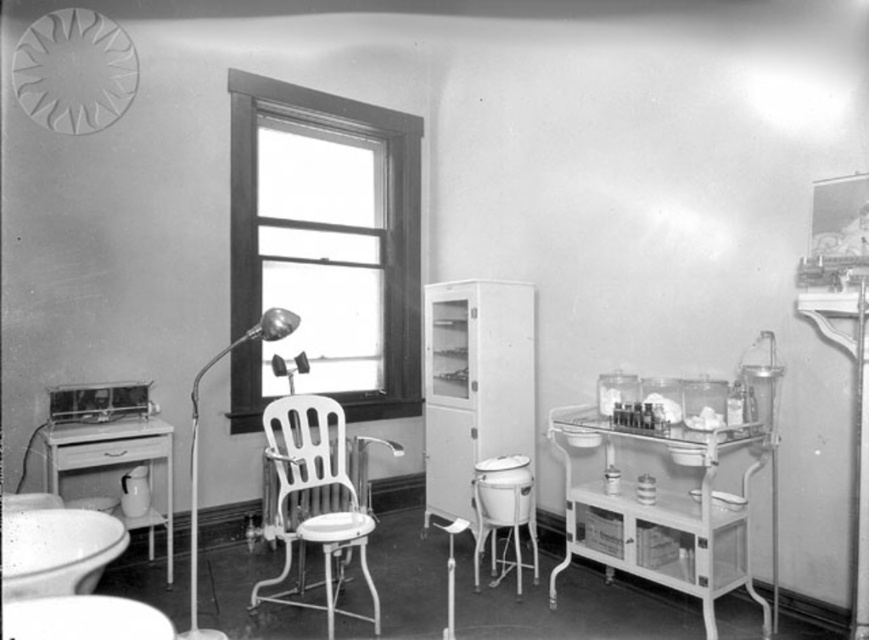
Question: In this image, where is white plastic chair at center located relative to white glossy table at left?

Choices:
 (A) below
 (B) above

Answer: (A)

Question: Can you confirm if wooden frame window at center is positioned above metallic/reflective lamp at center-left?

Choices:
 (A) yes
 (B) no

Answer: (A)

Question: Which point is farther from the camera taking this photo?

Choices:
 (A) (87, 456)
 (B) (734, 518)
 (C) (73, 573)
 (D) (297, 316)

Answer: (D)

Question: Is white plastic chair at center to the right of white plastic stool at center from the viewer's perspective?

Choices:
 (A) yes
 (B) no

Answer: (B)

Question: Estimate the real-world distances between objects in this image. Which object is farther from the white plastic chair at center?

Choices:
 (A) metallic/reflective lamp at center-left
 (B) white plastic stool at center
 (C) metallic white cart at right

Answer: (C)

Question: Which point appears farthest from the camera in this image?

Choices:
 (A) (299, 284)
 (B) (521, 435)
 (C) (479, 493)
 (D) (289, 468)

Answer: (A)